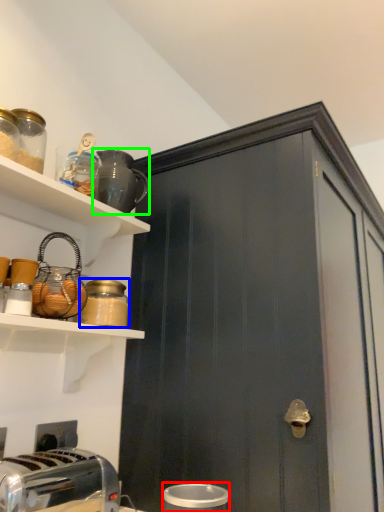
Question: Considering the real-world distances, which object is farthest from appliance (highlighted by a red box)? bottle (highlighted by a blue box) or appliance (highlighted by a green box)?

Choices:
 (A) bottle
 (B) appliance

Answer: (B)